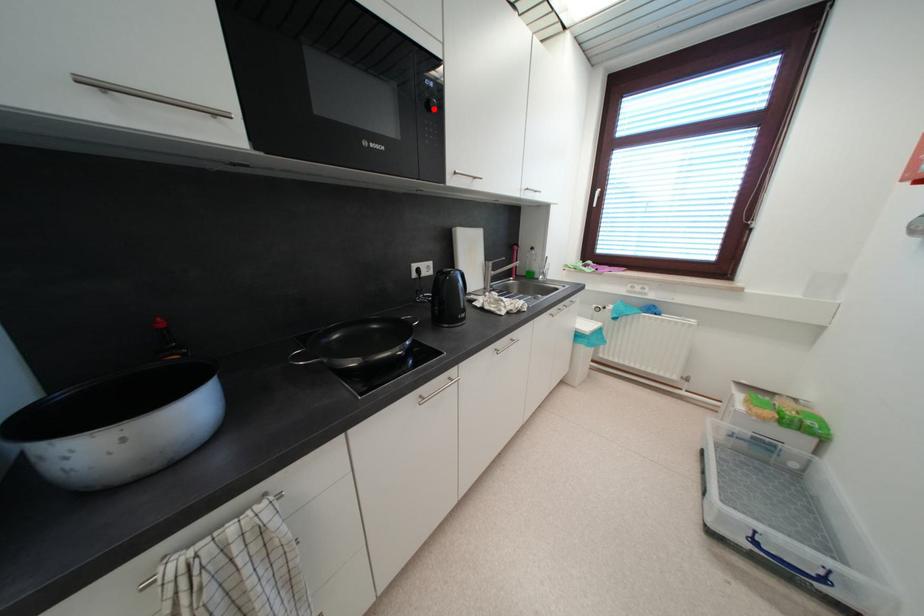
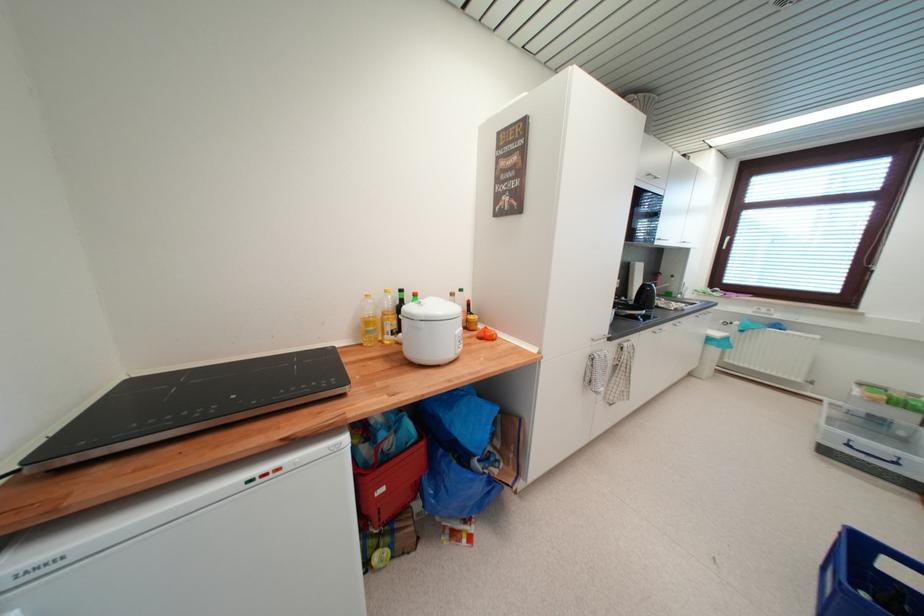
Question: I am providing you with two images of the same scene from different viewpoints. A red point is marked on the first image. Can you still see the location of the red point in image 2?

Choices:
 (A) Yes
 (B) No

Answer: (B)